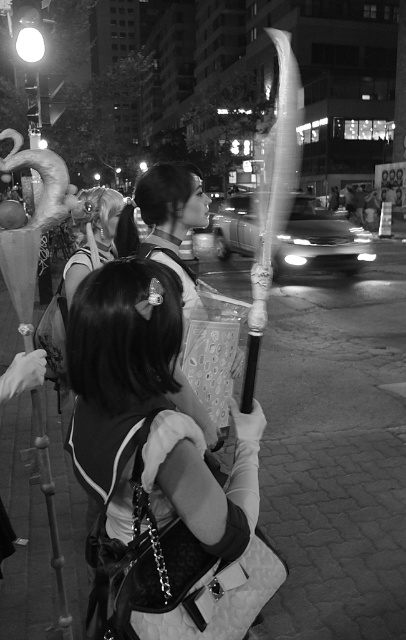
Can you confirm if smooth white cane at upper center is positioned above metallic streetlight at upper left?

Yes, smooth white cane at upper center is above metallic streetlight at upper left.

Looking at this image, does smooth white cane at upper center have a greater height compared to metallic streetlight at upper left?

Yes.

This screenshot has width=406, height=640. I want to click on smooth white cane at upper center, so click(x=272, y=200).

Where is `smooth white cane at upper center`? The image size is (406, 640). smooth white cane at upper center is located at coordinates (272, 200).

Is smooth white cane at upper center smaller than shiny silver hair at center?

No.

Does point (284, 179) come behind point (110, 228)?

Yes, it is.

At what (x,y) coordinates should I click in order to perform the action: click on smooth white cane at upper center. Please return your answer as a coordinate pair (x, y). The height and width of the screenshot is (640, 406). Looking at the image, I should click on (272, 200).

Can you confirm if matte black bag at center is positioned to the left of metallic streetlight at upper left?

Incorrect, matte black bag at center is not on the left side of metallic streetlight at upper left.

Consider the image. Who is more forward, (110,420) or (34,115)?

Point (110,420)

Where is `matte black bag at center`? The image size is (406, 640). matte black bag at center is located at coordinates (120, 376).